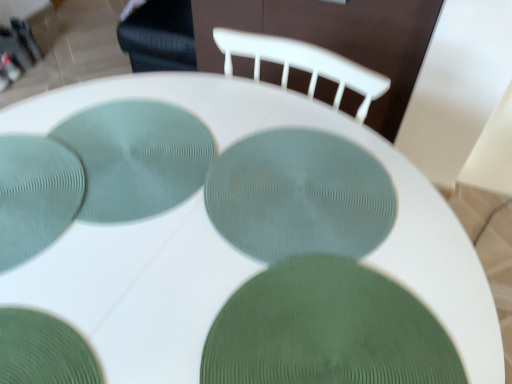
At what (x,y) coordinates should I click in order to perform the action: click on unoccupied area behind matte green plate at center, acting as the fourth glass plate starting from the left. Please return your answer as a coordinate pair (x, y). Looking at the image, I should click on (254, 106).